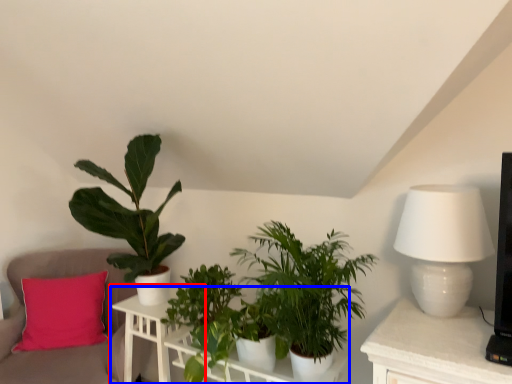
Question: Which object appears closest to the camera in this image, table (highlighted by a red box) or table (highlighted by a blue box)?

Choices:
 (A) table
 (B) table

Answer: (B)